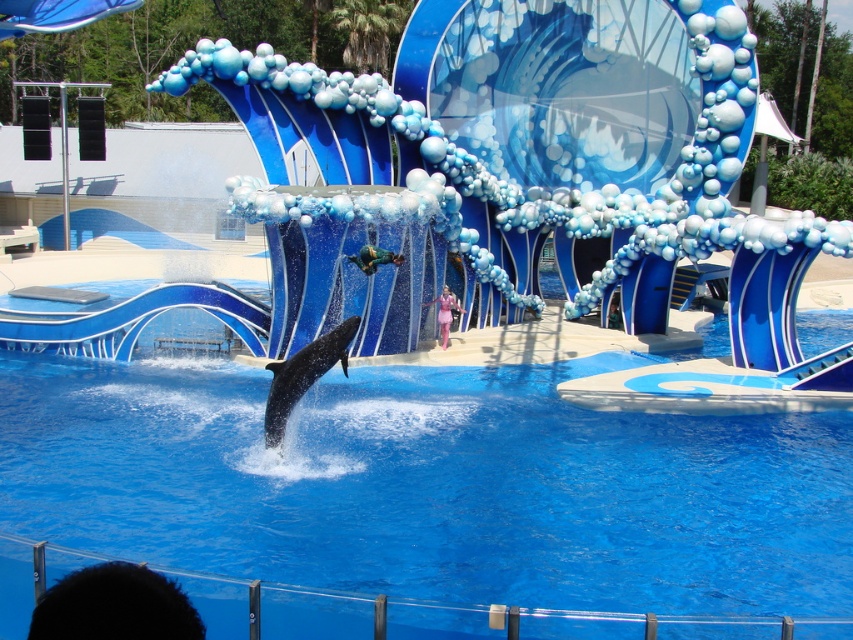
Question: Is black smooth dolphin at center positioned at the back of green fabric person at center?

Choices:
 (A) no
 (B) yes

Answer: (A)

Question: Is black smooth dolphin at center wider than green fabric person at center?

Choices:
 (A) yes
 (B) no

Answer: (B)

Question: Which of the following is the farthest from the observer?

Choices:
 (A) pink satin dress at center
 (B) black smooth dolphin at center
 (C) green fabric person at center

Answer: (A)

Question: Estimate the real-world distances between objects in this image. Which object is closer to the green fabric person at center?

Choices:
 (A) black smooth dolphin at center
 (B) pink satin dress at center

Answer: (A)

Question: From the image, what is the correct spatial relationship of black smooth dolphin at center in relation to green fabric person at center?

Choices:
 (A) above
 (B) below

Answer: (B)

Question: Which of the following is the closest to the observer?

Choices:
 (A) (434, 301)
 (B) (384, 259)

Answer: (B)